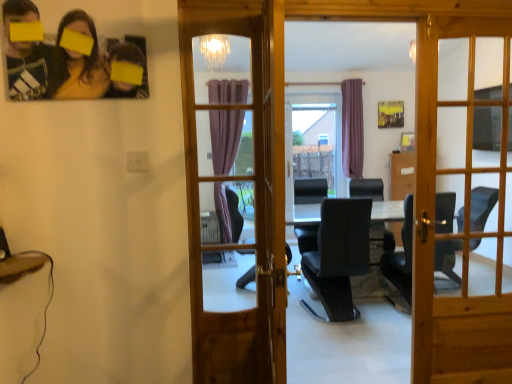
Question: Does wooden door at center, which ranks as the 2th door in right-to-left order, have a lesser width compared to matte black photo frame at upper left?

Choices:
 (A) no
 (B) yes

Answer: (A)

Question: Is wooden door at center, the 1th door from the left, to the left of matte black photo frame at upper left from the viewer's perspective?

Choices:
 (A) yes
 (B) no

Answer: (B)

Question: Is wooden door at center, the 1th door from the left, facing towards matte black photo frame at upper left?

Choices:
 (A) no
 (B) yes

Answer: (A)

Question: Is wooden door at center, the 1th door from the left, shorter than matte black photo frame at upper left?

Choices:
 (A) no
 (B) yes

Answer: (A)

Question: Is wooden door at center, the 1th door from the left, looking in the opposite direction of matte black photo frame at upper left?

Choices:
 (A) yes
 (B) no

Answer: (B)

Question: Considering the positions of matte black photo frame at upper left and black leather chair at center in the image, is matte black photo frame at upper left wider or thinner than black leather chair at center?

Choices:
 (A) wide
 (B) thin

Answer: (B)

Question: From the image's perspective, is matte black photo frame at upper left above or below black leather chair at center?

Choices:
 (A) below
 (B) above

Answer: (B)

Question: Considering the positions of point (15, 84) and point (380, 193), is point (15, 84) closer or farther from the camera than point (380, 193)?

Choices:
 (A) farther
 (B) closer

Answer: (B)

Question: Is matte black photo frame at upper left inside the boundaries of black leather chair at center, or outside?

Choices:
 (A) inside
 (B) outside

Answer: (B)

Question: Is wooden door at center, the 1th door from the left, inside the boundaries of black leather chair at center, or outside?

Choices:
 (A) outside
 (B) inside

Answer: (A)

Question: From a real-world perspective, is wooden door at center, which ranks as the 2th door in right-to-left order, physically located above or below black leather chair at center?

Choices:
 (A) below
 (B) above

Answer: (B)

Question: Is point (194, 170) closer or farther from the camera than point (366, 188)?

Choices:
 (A) farther
 (B) closer

Answer: (B)

Question: Is wooden door at center, which ranks as the 2th door in right-to-left order, to the left or to the right of black leather chair at center in the image?

Choices:
 (A) right
 (B) left

Answer: (B)

Question: From their relative heights in the image, would you say wooden door at center, which ranks as the 2th door in left-to-right order, is taller or shorter than black leather chair at center?

Choices:
 (A) tall
 (B) short

Answer: (A)

Question: Is wooden door at center, marked as the 1th door in a right-to-left arrangement, inside the boundaries of black leather chair at center, or outside?

Choices:
 (A) outside
 (B) inside

Answer: (A)